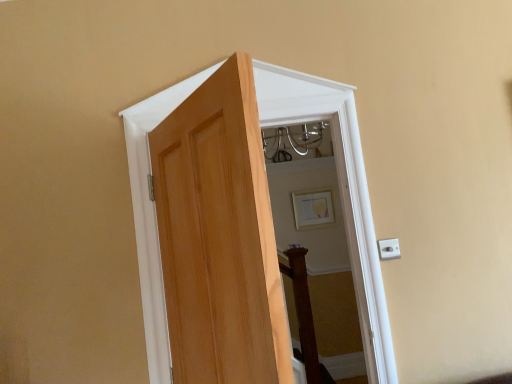
What do you see at coordinates (313, 209) in the screenshot? I see `matte gold picture frame at upper center` at bounding box center [313, 209].

Describe the element at coordinates (388, 249) in the screenshot. The width and height of the screenshot is (512, 384). I see `white plastic electric outlet at right` at that location.

In order to click on matte gold picture frame at upper center in this screenshot , I will do `click(313, 209)`.

Which of these two, natural wood door at center or matte gold picture frame at upper center, is wider?

natural wood door at center.

Considering the relative positions of natural wood door at center and matte gold picture frame at upper center in the image provided, is natural wood door at center to the left or to the right of matte gold picture frame at upper center?

Clearly, natural wood door at center is on the left of matte gold picture frame at upper center in the image.

Which object is closer to the camera, natural wood door at center or matte gold picture frame at upper center?

natural wood door at center is in front.

Considering the relative sizes of natural wood door at center and white plastic electric outlet at right in the image provided, is natural wood door at center taller than white plastic electric outlet at right?

Yes, natural wood door at center is taller than white plastic electric outlet at right.

In the scene shown: Is natural wood door at center facing towards white plastic electric outlet at right?

No, natural wood door at center does not turn towards white plastic electric outlet at right.

Can you confirm if natural wood door at center is wider than white plastic electric outlet at right?

Correct, the width of natural wood door at center exceeds that of white plastic electric outlet at right.

Is white plastic electric outlet at right not close to matte gold picture frame at upper center?

Yes, white plastic electric outlet at right and matte gold picture frame at upper center are quite far apart.

From the image's perspective, relative to matte gold picture frame at upper center, is white plastic electric outlet at right above or below?

From the image's perspective, white plastic electric outlet at right appears below matte gold picture frame at upper center.

Between white plastic electric outlet at right and matte gold picture frame at upper center, which one appears on the right side from the viewer's perspective?

matte gold picture frame at upper center is more to the right.

How different are the orientations of matte gold picture frame at upper center and white plastic electric outlet at right in degrees?

The facing directions of matte gold picture frame at upper center and white plastic electric outlet at right are 0.583 degrees apart.

From a real-world perspective, between matte gold picture frame at upper center and white plastic electric outlet at right, who is vertically lower?

From a 3D spatial view, white plastic electric outlet at right is below.

Where is `electric outlet on the left of matte gold picture frame at upper center`? electric outlet on the left of matte gold picture frame at upper center is located at coordinates (388, 249).

Considering the sizes of white plastic electric outlet at right and natural wood door at center in the image, is white plastic electric outlet at right taller or shorter than natural wood door at center?

white plastic electric outlet at right is shorter than natural wood door at center.

What's the angular difference between white plastic electric outlet at right and natural wood door at center's facing directions?

2.46 degrees.

Visually, is white plastic electric outlet at right positioned to the left or to the right of natural wood door at center?

Based on their positions, white plastic electric outlet at right is located to the right of natural wood door at center.

Would you say white plastic electric outlet at right is inside or outside natural wood door at center?

white plastic electric outlet at right cannot be found inside natural wood door at center.

Between matte gold picture frame at upper center and natural wood door at center, which one is positioned behind?

matte gold picture frame at upper center.

From the image's perspective, who appears lower, matte gold picture frame at upper center or natural wood door at center?

matte gold picture frame at upper center.

From their relative heights in the image, would you say matte gold picture frame at upper center is taller or shorter than natural wood door at center?

Considering their sizes, matte gold picture frame at upper center has less height than natural wood door at center.

Find the location of a particular element. The image size is (512, 384). picture frame behind the natural wood door at center is located at coordinates (313, 209).

Find the location of a particular element. Image resolution: width=512 pixels, height=384 pixels. electric outlet below the natural wood door at center (from the image's perspective) is located at coordinates (388, 249).

Which object lies nearer to the anchor point natural wood door at center, white plastic electric outlet at right or matte gold picture frame at upper center?

white plastic electric outlet at right is closer to natural wood door at center.

Considering their positions, is matte gold picture frame at upper center positioned closer to white plastic electric outlet at right than natural wood door at center?

natural wood door at center is positioned closer to the anchor white plastic electric outlet at right.

Looking at this image, estimate the real-world distances between objects in this image. Which object is further from natural wood door at center, matte gold picture frame at upper center or white plastic electric outlet at right?

matte gold picture frame at upper center is positioned further to the anchor natural wood door at center.

Considering their positions, is natural wood door at center positioned closer to matte gold picture frame at upper center than white plastic electric outlet at right?

The object closer to matte gold picture frame at upper center is natural wood door at center.

When comparing their distances from white plastic electric outlet at right, does natural wood door at center or matte gold picture frame at upper center seem closer?

Among the two, natural wood door at center is located nearer to white plastic electric outlet at right.

Which object lies further to the anchor point matte gold picture frame at upper center, white plastic electric outlet at right or natural wood door at center?

white plastic electric outlet at right lies further to matte gold picture frame at upper center than the other object.

Identify the location of electric outlet positioned between natural wood door at center and matte gold picture frame at upper center from near to far. The height and width of the screenshot is (384, 512). (388, 249).